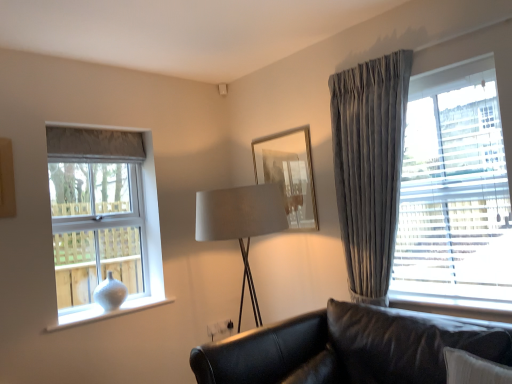
Question: Considering the relative positions of black leather couch at lower right and white matte vase at left, the first window from the back, in the image provided, is black leather couch at lower right to the right of white matte vase at left, the first window from the back, from the viewer's perspective?

Choices:
 (A) yes
 (B) no

Answer: (A)

Question: Can you confirm if black leather couch at lower right is bigger than white matte vase at left, the second window positioned from the right?

Choices:
 (A) yes
 (B) no

Answer: (A)

Question: Is black leather couch at lower right located outside white matte vase at left, which is the second window in front-to-back order?

Choices:
 (A) no
 (B) yes

Answer: (B)

Question: Can white matte vase at left, the second window positioned from the right, be found inside black leather couch at lower right?

Choices:
 (A) no
 (B) yes

Answer: (A)

Question: Does black leather couch at lower right lie in front of white matte vase at left, the first window from the back?

Choices:
 (A) no
 (B) yes

Answer: (B)

Question: Is black leather couch at lower right taller or shorter than velvet gray curtain at right, which is the 1th window in right-to-left order?

Choices:
 (A) tall
 (B) short

Answer: (B)

Question: In the image, is black leather couch at lower right positioned in front of or behind velvet gray curtain at right, which is the 1th window in right-to-left order?

Choices:
 (A) behind
 (B) front

Answer: (B)

Question: From the image's perspective, is black leather couch at lower right positioned above or below velvet gray curtain at right, positioned as the second window in back-to-front order?

Choices:
 (A) below
 (B) above

Answer: (A)

Question: Looking at their shapes, would you say black leather couch at lower right is wider or thinner than velvet gray curtain at right, which is the 1th window in right-to-left order?

Choices:
 (A) wide
 (B) thin

Answer: (A)

Question: Considering their positions, is satin grey curtain at right located in front of or behind white glossy vase at lower left?

Choices:
 (A) front
 (B) behind

Answer: (A)

Question: From the image's perspective, is satin grey curtain at right above or below white glossy vase at lower left?

Choices:
 (A) below
 (B) above

Answer: (B)

Question: In terms of size, does satin grey curtain at right appear bigger or smaller than white glossy vase at lower left?

Choices:
 (A) big
 (B) small

Answer: (A)

Question: In the image, is satin grey curtain at right on the left side or the right side of white glossy vase at lower left?

Choices:
 (A) left
 (B) right

Answer: (B)

Question: Do you think satin beige lampshade at center is within velvet gray curtain at right, which is the 1th window in right-to-left order, or outside of it?

Choices:
 (A) inside
 (B) outside

Answer: (B)

Question: From the image's perspective, is satin beige lampshade at center above or below velvet gray curtain at right, which is the 1th window in right-to-left order?

Choices:
 (A) above
 (B) below

Answer: (B)